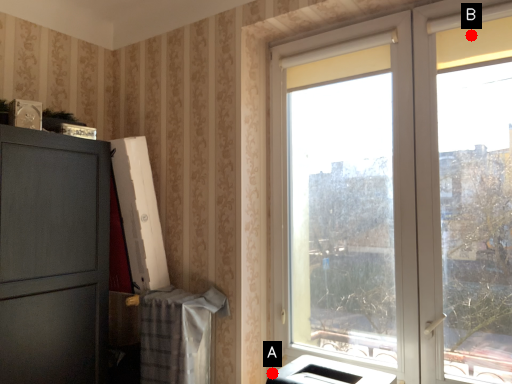
Question: Two points are circled on the image, labeled by A and B beside each circle. Among these points, which one is nearest to the camera?

Choices:
 (A) A is closer
 (B) B is closer

Answer: (B)